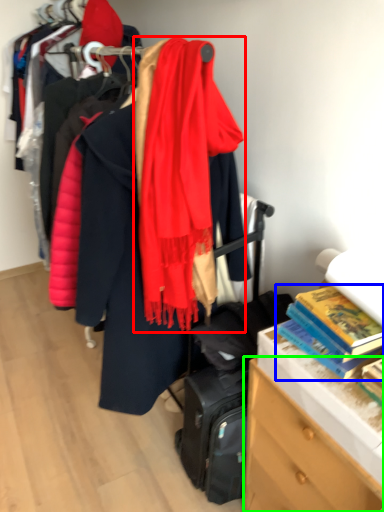
Question: Considering the real-world distances, which object is farthest from scarf (highlighted by a red box)? book (highlighted by a blue box) or chest of drawers (highlighted by a green box)?

Choices:
 (A) book
 (B) chest of drawers

Answer: (B)